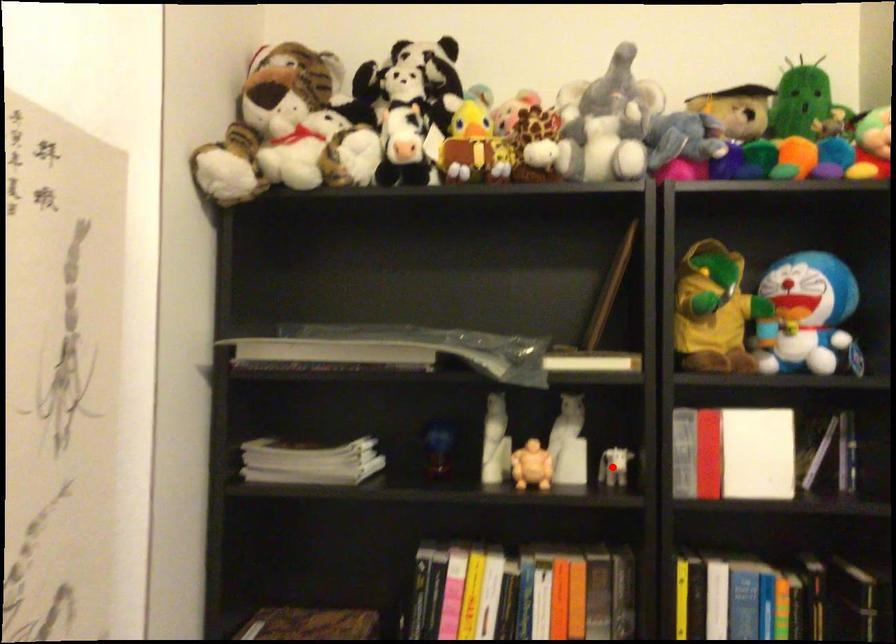
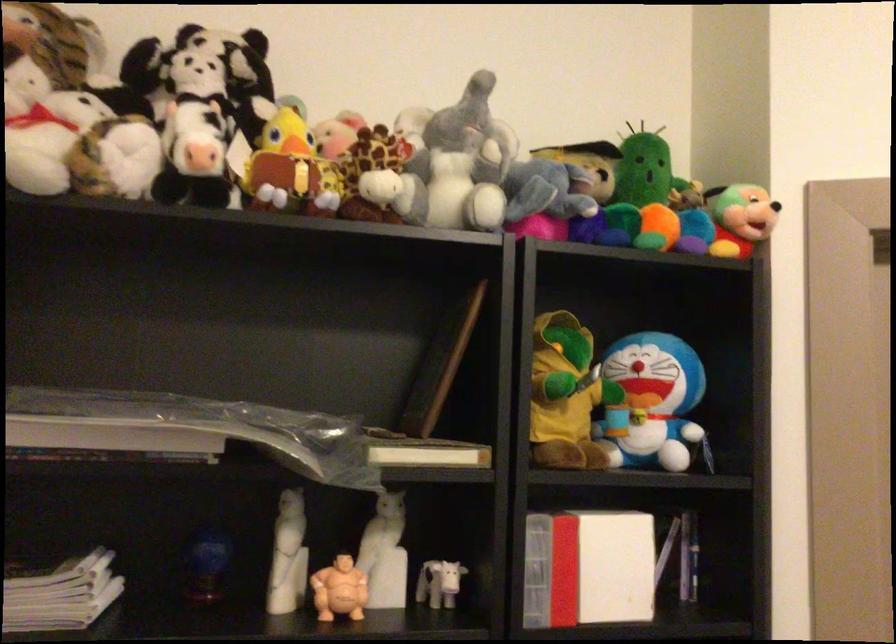
Question: A red point is marked in image1. In image2, is the corresponding 3D point closer to the camera or farther? Reply with the corresponding letter.

Choices:
 (A) The corresponding 3D point is closer.
 (B) The corresponding 3D point is farther.

Answer: (A)